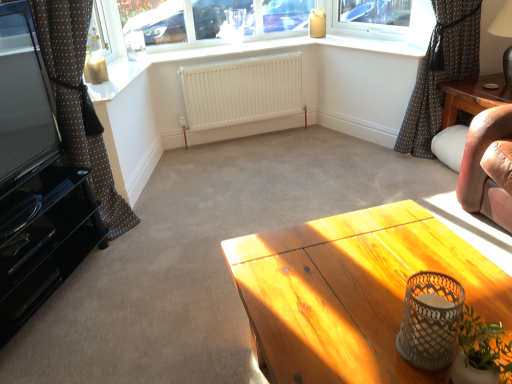
What is the approximate width of black glossy entertainment center at left?

black glossy entertainment center at left is 22.22 centimeters in width.

In order to face clear glass window at upper center, should I rotate leftwards or rightwards?

A 3.728 degree turn to the left will do.

Describe the element at coordinates (241, 91) in the screenshot. The height and width of the screenshot is (384, 512). I see `white matte radiator at center` at that location.

The image size is (512, 384). What are the coordinates of `brown polka dot fabric at left, the first curtain positioned from the left` in the screenshot? It's located at (92, 163).

The image size is (512, 384). What do you see at coordinates (92, 163) in the screenshot?
I see `brown polka dot fabric at left, which is counted as the 2th curtain, starting from the right` at bounding box center [92, 163].

You are a GUI agent. You are given a task and a screenshot of the screen. Output one action in this format:
    pyautogui.click(x=<x>, y=<y>)
    Task: Click on the black glossy entertainment center at left
    Image resolution: width=512 pixels, height=384 pixels.
    Given the screenshot: What is the action you would take?
    pyautogui.click(x=37, y=193)

From a real-world perspective, is black glossy entertainment center at left over brown dotted fabric at right, marked as the 2th curtain in a left-to-right arrangement?

Yes, from a real-world perspective, black glossy entertainment center at left is above brown dotted fabric at right, marked as the 2th curtain in a left-to-right arrangement.

Is point (27, 267) in front of point (463, 78)?

Yes, it is in front of point (463, 78).

At what (x,y) coordinates should I click in order to perform the action: click on entertainment center that is on the left side of brown dotted fabric at right, the first curtain positioned from the right. Please return your answer as a coordinate pair (x, y). Looking at the image, I should click on (37, 193).

Who is smaller, black glossy entertainment center at left or brown dotted fabric at right, the first curtain positioned from the right?

black glossy entertainment center at left.

Is white matte radiator at center oriented away from brown polka dot fabric at left, the first curtain positioned from the left?

No.

Is white matte radiator at center bigger than brown polka dot fabric at left, which is counted as the 2th curtain, starting from the right?

No.

Based on the photo, which is behind, white matte radiator at center or brown polka dot fabric at left, which is counted as the 2th curtain, starting from the right?

white matte radiator at center is further from the camera.

From a real-world perspective, which object rests below the other?

From a 3D spatial view, white matte radiator at center is below.

How different are the orientations of brown polka dot fabric at left, which is counted as the 2th curtain, starting from the right, and white matte radiator at center in degrees?

brown polka dot fabric at left, which is counted as the 2th curtain, starting from the right, and white matte radiator at center are facing 76.1 degrees away from each other.

Considering the positions of point (61, 13) and point (216, 78), is point (61, 13) closer or farther from the camera than point (216, 78)?

Point (61, 13) appears to be closer to the viewer than point (216, 78).

From the image's perspective, is brown polka dot fabric at left, which is counted as the 2th curtain, starting from the right, above or below white matte radiator at center?

Clearly, from the image's perspective, brown polka dot fabric at left, which is counted as the 2th curtain, starting from the right, is below white matte radiator at center.

Is black glossy entertainment center at left far away from clear glass window at upper center?

That's right, there is a large distance between black glossy entertainment center at left and clear glass window at upper center.

Does black glossy entertainment center at left have a lesser width compared to clear glass window at upper center?

Incorrect, the width of black glossy entertainment center at left is not less than that of clear glass window at upper center.

Is black glossy entertainment center at left oriented away from clear glass window at upper center?

No, black glossy entertainment center at left is not facing away from clear glass window at upper center.

Identify the location of window above the black glossy entertainment center at left (from the image's perspective). The width and height of the screenshot is (512, 384). (359, 34).

Considering the sizes of objects white matte radiator at center and brown dotted fabric at right, the first curtain positioned from the right, in the image provided, who is thinner, white matte radiator at center or brown dotted fabric at right, the first curtain positioned from the right,?

white matte radiator at center.

Considering the positions of point (188, 67) and point (448, 50), is point (188, 67) closer or farther from the camera than point (448, 50)?

Clearly, point (188, 67) is more distant from the camera than point (448, 50).

From the image's perspective, who appears lower, white matte radiator at center or brown dotted fabric at right, the first curtain positioned from the right?

white matte radiator at center.

Considering the sizes of white matte radiator at center and brown dotted fabric at right, the first curtain positioned from the right, in the image, is white matte radiator at center bigger or smaller than brown dotted fabric at right, the first curtain positioned from the right,?

white matte radiator at center is smaller than brown dotted fabric at right, the first curtain positioned from the right.

In the image, there is a brown polka dot fabric at left, the first curtain positioned from the left. Identify the location of curtain above it (from the image's perspective). The height and width of the screenshot is (384, 512). (440, 72).

Considering the positions of points (426, 94) and (70, 151), is point (426, 94) farther from camera compared to point (70, 151)?

That is True.

In terms of height, does brown dotted fabric at right, marked as the 2th curtain in a left-to-right arrangement, look taller or shorter compared to brown polka dot fabric at left, the first curtain positioned from the left?

brown dotted fabric at right, marked as the 2th curtain in a left-to-right arrangement, is shorter than brown polka dot fabric at left, the first curtain positioned from the left.

Is brown dotted fabric at right, the first curtain positioned from the right, positioned beyond the bounds of brown polka dot fabric at left, which is counted as the 2th curtain, starting from the right?

brown dotted fabric at right, the first curtain positioned from the right, lies outside brown polka dot fabric at left, which is counted as the 2th curtain, starting from the right,'s area.

Visually, is brown dotted fabric at right, marked as the 2th curtain in a left-to-right arrangement, positioned to the left or to the right of white matte vase at lower right?

In the image, brown dotted fabric at right, marked as the 2th curtain in a left-to-right arrangement, appears on the right side of white matte vase at lower right.

In the scene shown: Is brown dotted fabric at right, the first curtain positioned from the right, located outside white matte vase at lower right?

Absolutely, brown dotted fabric at right, the first curtain positioned from the right, is external to white matte vase at lower right.

Is white matte vase at lower right at the back of brown dotted fabric at right, the first curtain positioned from the right?

No, brown dotted fabric at right, the first curtain positioned from the right, is not facing the opposite direction of white matte vase at lower right.

The height and width of the screenshot is (384, 512). I want to click on entertainment center located on the left of brown dotted fabric at right, the first curtain positioned from the right, so click(37, 193).

The width and height of the screenshot is (512, 384). I want to click on radiator on the right of brown polka dot fabric at left, which is counted as the 2th curtain, starting from the right, so click(x=241, y=91).

When comparing their distances from clear glass window at upper center, does white matte vase at lower right or brown polka dot fabric at left, the first curtain positioned from the left, seem closer?

brown polka dot fabric at left, the first curtain positioned from the left, lies closer to clear glass window at upper center than the other object.

From the image, which object appears to be farther from brown polka dot fabric at left, the first curtain positioned from the left, white matte radiator at center or brown dotted fabric at right, marked as the 2th curtain in a left-to-right arrangement?

Based on the image, brown dotted fabric at right, marked as the 2th curtain in a left-to-right arrangement, appears to be further to brown polka dot fabric at left, the first curtain positioned from the left.

When comparing their distances from matte white window sill at upper center, does black glossy entertainment center at left or white matte radiator at center seem further?

The object further to matte white window sill at upper center is black glossy entertainment center at left.

Based on their spatial positions, is clear glass window at upper center or brown polka dot fabric at left, the first curtain positioned from the left, further from white matte vase at lower right?

clear glass window at upper center.

Considering their positions, is clear glass window at upper center positioned further to brown polka dot fabric at left, the first curtain positioned from the left, than white matte radiator at center?

clear glass window at upper center is further to brown polka dot fabric at left, the first curtain positioned from the left.

Estimate the real-world distances between objects in this image. Which object is further from clear glass window at upper center, brown polka dot fabric at left, the first curtain positioned from the left, or matte white window sill at upper center?

Among the two, brown polka dot fabric at left, the first curtain positioned from the left, is located further to clear glass window at upper center.

Based on their spatial positions, is brown polka dot fabric at left, which is counted as the 2th curtain, starting from the right, or matte white window sill at upper center closer to brown dotted fabric at right, the first curtain positioned from the right?

Based on the image, matte white window sill at upper center appears to be nearer to brown dotted fabric at right, the first curtain positioned from the right.

Looking at the image, which one is located further to brown polka dot fabric at left, which is counted as the 2th curtain, starting from the right, matte white window sill at upper center or white matte radiator at center?

matte white window sill at upper center is positioned further to the anchor brown polka dot fabric at left, which is counted as the 2th curtain, starting from the right.

Where is `curtain located between black glossy entertainment center at left and brown dotted fabric at right, marked as the 2th curtain in a left-to-right arrangement, in the left-right direction`? The width and height of the screenshot is (512, 384). curtain located between black glossy entertainment center at left and brown dotted fabric at right, marked as the 2th curtain in a left-to-right arrangement, in the left-right direction is located at coordinates (92, 163).

Image resolution: width=512 pixels, height=384 pixels. Identify the location of plant situated between black glossy entertainment center at left and brown dotted fabric at right, marked as the 2th curtain in a left-to-right arrangement, from left to right. (481, 352).

I want to click on radiator located between brown polka dot fabric at left, which is counted as the 2th curtain, starting from the right, and brown dotted fabric at right, the first curtain positioned from the right, in the left-right direction, so click(241, 91).

What are the coordinates of `window sill located between white matte vase at lower right and clear glass window at upper center in the depth direction` in the screenshot? It's located at (376, 44).